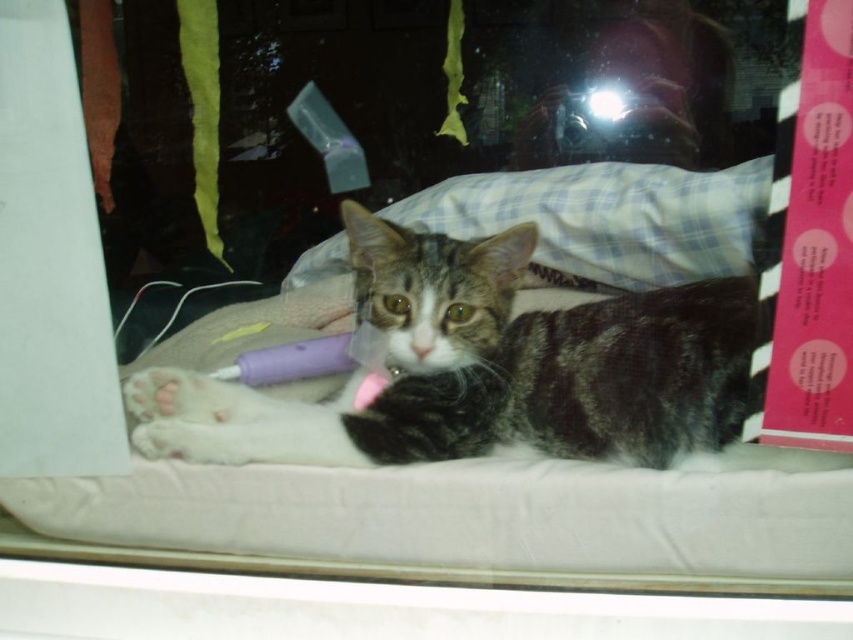
Does point (672, 394) lie in front of point (634, 278)?

Yes, it is.

Find the location of a particular element. This screenshot has height=640, width=853. tabby fur cat at center is located at coordinates (482, 369).